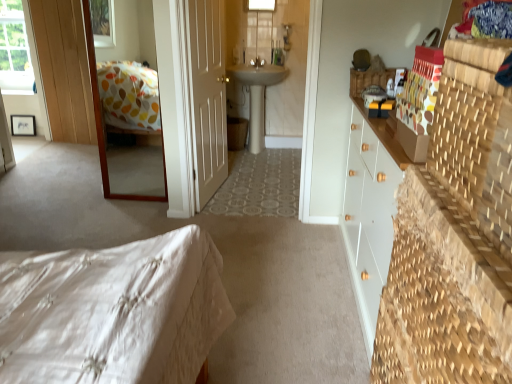
Question: Can you confirm if transparent glass window at upper left, which is counted as the second window, starting from the right, is bigger than white quilted bed at lower left?

Choices:
 (A) no
 (B) yes

Answer: (A)

Question: Does transparent glass window at upper left, which is the 2th window from front to back, turn towards white quilted bed at lower left?

Choices:
 (A) yes
 (B) no

Answer: (B)

Question: Is transparent glass window at upper left, which is the 2th window from front to back, taller than white quilted bed at lower left?

Choices:
 (A) yes
 (B) no

Answer: (A)

Question: From a real-world perspective, is transparent glass window at upper left, which is the first window in back-to-front order, beneath white quilted bed at lower left?

Choices:
 (A) no
 (B) yes

Answer: (A)

Question: Does transparent glass window at upper left, which is counted as the second window, starting from the right, come in front of white quilted bed at lower left?

Choices:
 (A) no
 (B) yes

Answer: (A)

Question: Considering their positions, is white ceramic sink at center located in front of or behind wooden-framed mirror at upper left?

Choices:
 (A) behind
 (B) front

Answer: (A)

Question: In terms of size, does white ceramic sink at center appear bigger or smaller than wooden-framed mirror at upper left?

Choices:
 (A) big
 (B) small

Answer: (A)

Question: From the image's perspective, is white ceramic sink at center located above or below wooden-framed mirror at upper left?

Choices:
 (A) above
 (B) below

Answer: (A)

Question: Is white ceramic sink at center situated inside wooden-framed mirror at upper left or outside?

Choices:
 (A) outside
 (B) inside

Answer: (A)

Question: From the image's perspective, is transparent glass window at upper left, which is the 2th window from front to back, located above or below wooden-framed mirror at upper left?

Choices:
 (A) above
 (B) below

Answer: (A)

Question: Would you say transparent glass window at upper left, the 1th window in the left-to-right sequence, is to the left or to the right of wooden-framed mirror at upper left in the picture?

Choices:
 (A) left
 (B) right

Answer: (A)

Question: Is transparent glass window at upper left, the 1th window in the left-to-right sequence, in front of or behind wooden-framed mirror at upper left in the image?

Choices:
 (A) behind
 (B) front

Answer: (A)

Question: From a real-world perspective, is transparent glass window at upper left, which is counted as the second window, starting from the right, positioned above or below wooden-framed mirror at upper left?

Choices:
 (A) below
 (B) above

Answer: (B)

Question: In terms of height, does wooden-framed mirror at upper left look taller or shorter compared to white matte door at center?

Choices:
 (A) short
 (B) tall

Answer: (A)

Question: From the image's perspective, is wooden-framed mirror at upper left positioned above or below white matte door at center?

Choices:
 (A) below
 (B) above

Answer: (A)